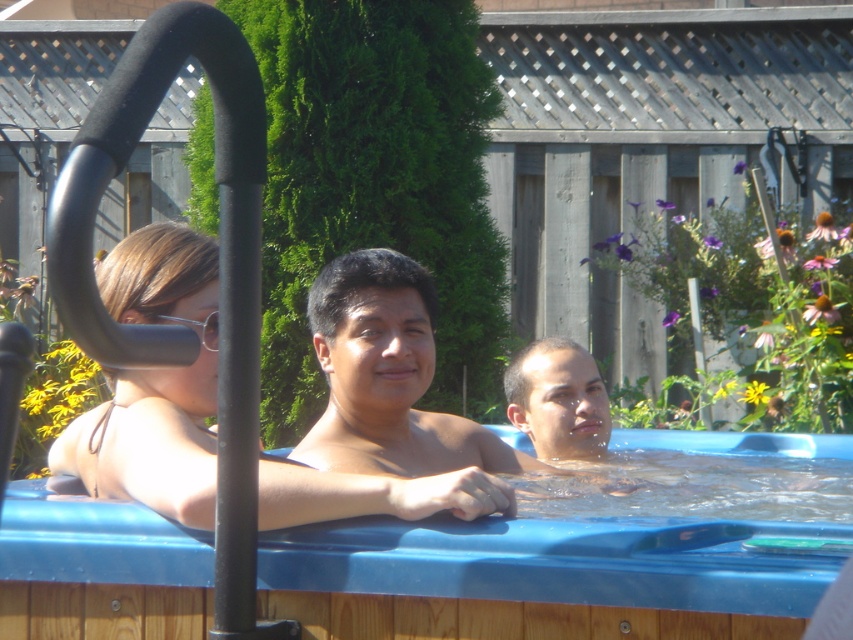
You are a lifeguard at this outdoor hot tub area. You need to ensure that the water level is safe for all users. According to the scene description, what is the relationship between the height of the blue plastic hot tub at center and the matte black bikini top at center?

The blue plastic hot tub at center is shorter than the matte black bikini top at center, which means the water level is high enough to cover the shoulders of the individuals, as described in the scene.

You are standing in the backyard looking at the hot tub scene. Where is the matte black bikini top at center located in terms of its 2D coordinates?

The matte black bikini top at center is located at the 2D coordinates of point (x=154, y=384).